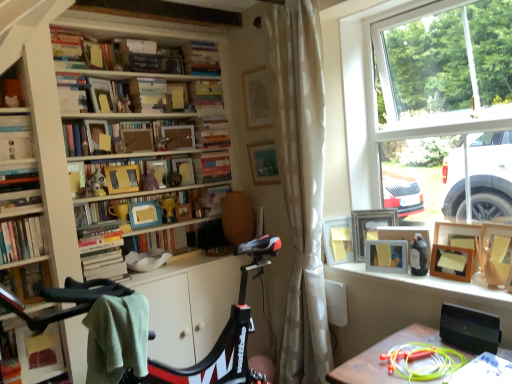
Question: From a real-world perspective, is wooden frame at center, placed as the seventh book when sorted from top to bottom, on matte black bird at upper right, marked as the third toy in a left-to-right arrangement?

Choices:
 (A) no
 (B) yes

Answer: (B)

Question: Could you tell me if wooden frame at center, the 7th book in the bottom-to-top sequence, is turned towards matte black bird at upper right, the first toy positioned from the front?

Choices:
 (A) yes
 (B) no

Answer: (B)

Question: From a real-world perspective, is wooden frame at center, placed as the seventh book when sorted from top to bottom, under matte black bird at upper right, which is the 3th toy in back-to-front order?

Choices:
 (A) yes
 (B) no

Answer: (B)

Question: Is wooden frame at center, the 7th book in the bottom-to-top sequence, positioned in front of matte black bird at upper right, which is the 3th toy in back-to-front order?

Choices:
 (A) yes
 (B) no

Answer: (B)

Question: Is matte black bird at upper right, the third toy positioned from the top, located within wooden frame at center, placed as the seventh book when sorted from top to bottom?

Choices:
 (A) yes
 (B) no

Answer: (B)

Question: Is wooden frame at center, the 7th book in the bottom-to-top sequence, far away from matte black bird at upper right, the third toy positioned from the top?

Choices:
 (A) yes
 (B) no

Answer: (A)

Question: Can you confirm if wooden picture frame at window, positioned as the 5th picture frame in left-to-right order, is bigger than wooden frame at upper center, acting as the eleventh book starting from the bottom?

Choices:
 (A) no
 (B) yes

Answer: (A)

Question: Is wooden picture frame at window, which is counted as the 2th picture frame, starting from the right, further to the viewer compared to wooden frame at upper center, acting as the eleventh book starting from the bottom?

Choices:
 (A) no
 (B) yes

Answer: (A)

Question: Can you confirm if wooden picture frame at window, which is counted as the 2th picture frame, starting from the right, is positioned to the right of wooden frame at upper center, which is the third book in top-to-bottom order?

Choices:
 (A) yes
 (B) no

Answer: (A)

Question: Is wooden picture frame at window, positioned as the 5th picture frame in left-to-right order, in contact with wooden frame at upper center, acting as the eleventh book starting from the bottom?

Choices:
 (A) yes
 (B) no

Answer: (B)

Question: Can you confirm if wooden picture frame at window, positioned as the 5th picture frame in left-to-right order, is wider than wooden frame at upper center, acting as the eleventh book starting from the bottom?

Choices:
 (A) no
 (B) yes

Answer: (A)

Question: Is there a large distance between wooden picture frame at window, positioned as the 5th picture frame in left-to-right order, and wooden frame at upper center, which is the third book in top-to-bottom order?

Choices:
 (A) yes
 (B) no

Answer: (A)

Question: Does hardcover books at center-left, the 2th book in the bottom-to-top sequence, have a smaller size compared to hardcover book at left, acting as the 8th book starting from the top?

Choices:
 (A) no
 (B) yes

Answer: (A)